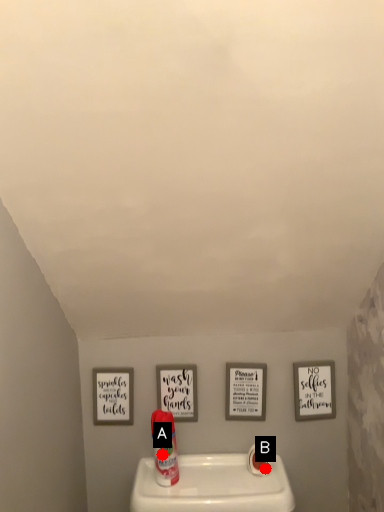
Question: Two points are circled on the image, labeled by A and B beside each circle. Which point appears closest to the camera in this image?

Choices:
 (A) A is closer
 (B) B is closer

Answer: (A)